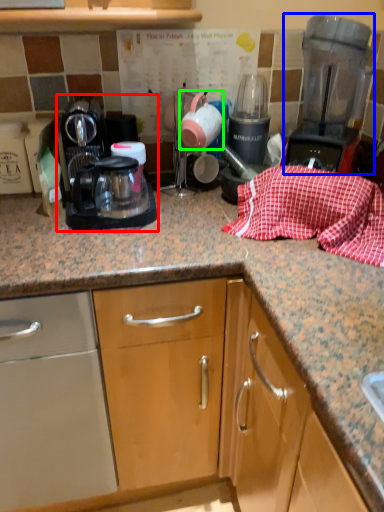
Question: Estimate the real-world distances between objects in this image. Which object is closer to kitchen appliance (highlighted by a red box), home appliance (highlighted by a blue box) or tea pot (highlighted by a green box)?

Choices:
 (A) home appliance
 (B) tea pot

Answer: (B)